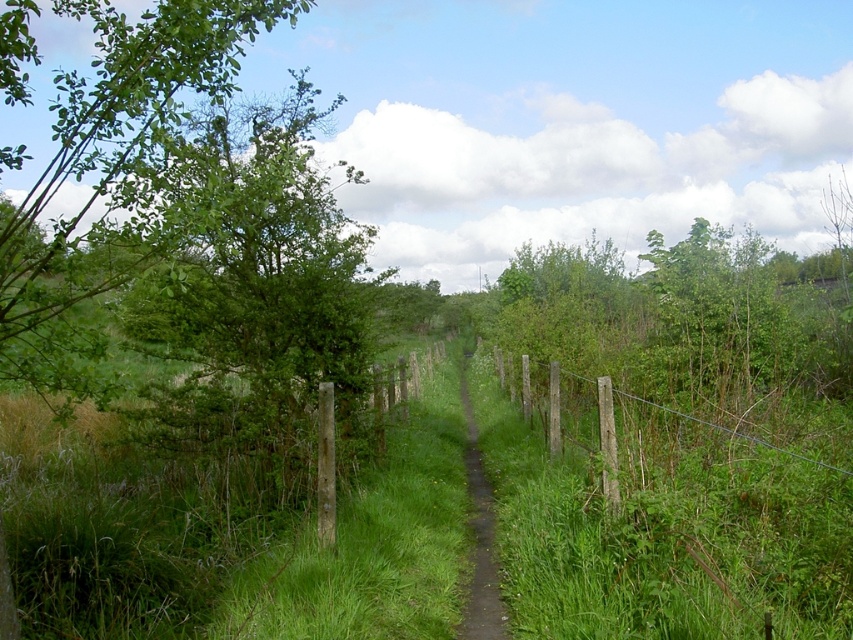
Question: Does green leafy tree at left have a smaller size compared to wooden post fence at right?

Choices:
 (A) no
 (B) yes

Answer: (A)

Question: Which object is farther from the camera taking this photo?

Choices:
 (A) wooden post fence at right
 (B) dirt path at center

Answer: (B)

Question: Does green leafy tree at left appear on the left side of dirt path at center?

Choices:
 (A) yes
 (B) no

Answer: (A)

Question: Does green leafy tree at left come behind wooden post fence at right?

Choices:
 (A) yes
 (B) no

Answer: (B)

Question: Which object is the closest to the green leafy tree at left?

Choices:
 (A) wooden post fence at right
 (B) dirt path at center

Answer: (B)

Question: Which point is farther to the camera?

Choices:
 (A) wooden post fence at right
 (B) green leafy tree at left

Answer: (A)